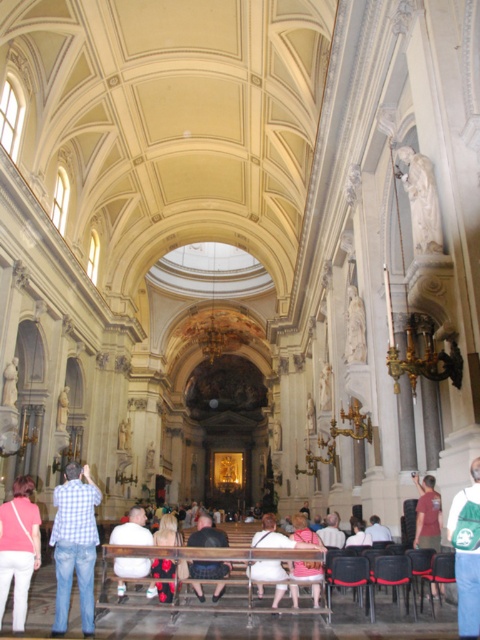
Is white cotton shirt at lower center further to the viewer compared to dark blue jeans at center?

Yes, it is behind dark blue jeans at center.

Is white cotton shirt at lower center taller than dark blue jeans at center?

Yes, white cotton shirt at lower center is taller than dark blue jeans at center.

Between point (121, 532) and point (215, 561), which one is positioned in front?

Point (215, 561)

You are a GUI agent. You are given a task and a screenshot of the screen. Output one action in this format:
    pyautogui.click(x=<x>, y=<y>)
    Task: Click on the white cotton shirt at lower center
    This screenshot has width=480, height=640.
    Given the screenshot: What is the action you would take?
    pyautogui.click(x=132, y=529)

Is matte pink shirt at lower left thinner than white cotton dress at center?

Yes.

Which is in front, point (15, 547) or point (269, 564)?

Point (15, 547)

The height and width of the screenshot is (640, 480). I want to click on matte pink shirt at lower left, so click(19, 548).

Does white fabric bag at lower right have a greater width compared to dark blue jeans at center?

In fact, white fabric bag at lower right might be narrower than dark blue jeans at center.

Is point (470, 592) positioned behind point (219, 577)?

No, it is in front of (219, 577).

Identify the location of white fabric bag at lower right. (468, 593).